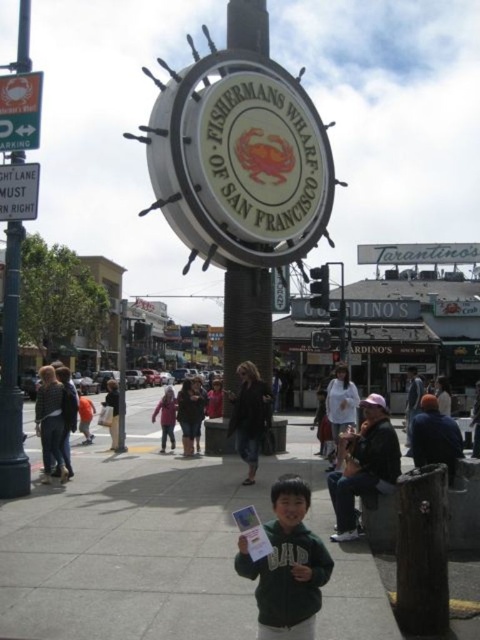
You are a delivery driver who needs to park your van near the metal parking sign at upper left and the metal sign at left. The van is 20 feet long. Can you safely park the van between these two signs without overlapping them?

The distance between the metal parking sign at upper left and the metal sign at left is 9.59 feet. Since the van is 20 feet long, it is too long to fit between them without overlapping the signs.

You are driving a car that is 4 meters long and want to park near the metal parking sign at upper left. The parking space you found is 4.5 meters long. Is the parking space long enough for your car?

The metal parking sign at upper left is 38.54 meters from camera, but the parking space length is 4.5 meters, which is sufficient for your 4 meter long car.

You are standing at the camera position and see the dark brown leather jacket at center. If you want to approach it, how many steps would you need to take if each step is approximately 0.76 meters?

The dark brown leather jacket at center is 45.47 meters away from camera. Dividing the distance by the step length of 0.76 meters gives approximately 60 steps. Therefore, you would need to take around 60 steps to reach the dark brown leather jacket at center.